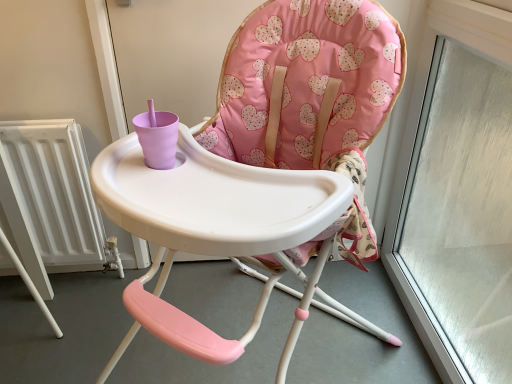
Question: Is pink fabric highchair at center not close to white metallic radiator at left?

Choices:
 (A) no
 (B) yes

Answer: (A)

Question: From a real-world perspective, is pink fabric highchair at center physically below white metallic radiator at left?

Choices:
 (A) no
 (B) yes

Answer: (A)

Question: Is pink fabric highchair at center turned away from white metallic radiator at left?

Choices:
 (A) yes
 (B) no

Answer: (B)

Question: Is pink fabric highchair at center to the right of white metallic radiator at left from the viewer's perspective?

Choices:
 (A) no
 (B) yes

Answer: (B)

Question: Is white metallic radiator at left surrounded by pink fabric highchair at center?

Choices:
 (A) no
 (B) yes

Answer: (A)

Question: Considering the relative sizes of pink fabric highchair at center and white metallic radiator at left in the image provided, is pink fabric highchair at center shorter than white metallic radiator at left?

Choices:
 (A) no
 (B) yes

Answer: (A)

Question: Does white metallic radiator at left appear on the left side of pink fabric highchair at center?

Choices:
 (A) no
 (B) yes

Answer: (B)

Question: Is white metallic radiator at left wider than pink fabric highchair at center?

Choices:
 (A) yes
 (B) no

Answer: (B)

Question: Does white metallic radiator at left have a greater height compared to pink fabric highchair at center?

Choices:
 (A) no
 (B) yes

Answer: (A)

Question: Can you confirm if white metallic radiator at left is smaller than pink fabric highchair at center?

Choices:
 (A) yes
 (B) no

Answer: (A)

Question: From the image's perspective, is white metallic radiator at left below pink fabric highchair at center?

Choices:
 (A) no
 (B) yes

Answer: (A)

Question: Does white metallic radiator at left lie behind pink fabric highchair at center?

Choices:
 (A) yes
 (B) no

Answer: (A)

Question: Looking at the image, does pink fabric highchair at center seem bigger or smaller compared to white metallic radiator at left?

Choices:
 (A) small
 (B) big

Answer: (B)